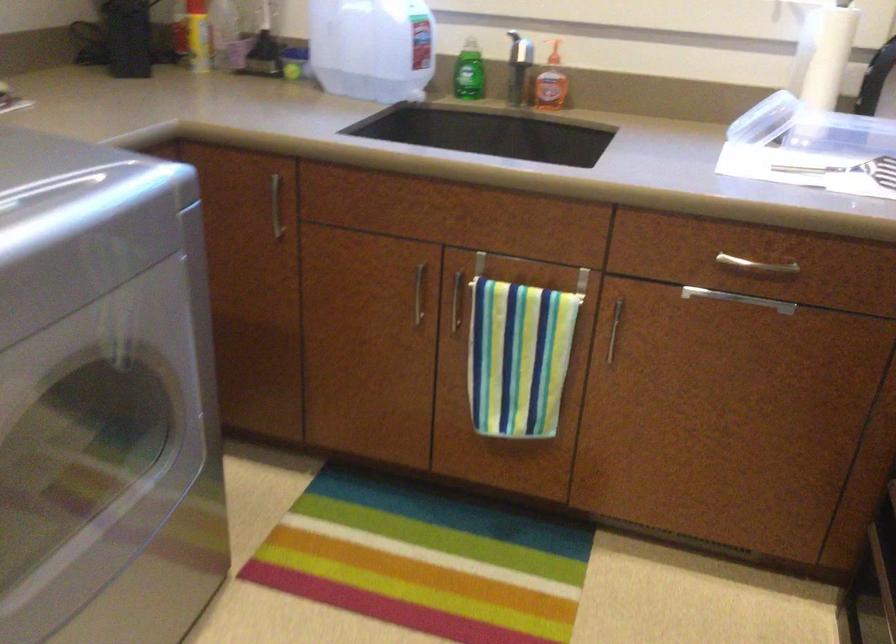
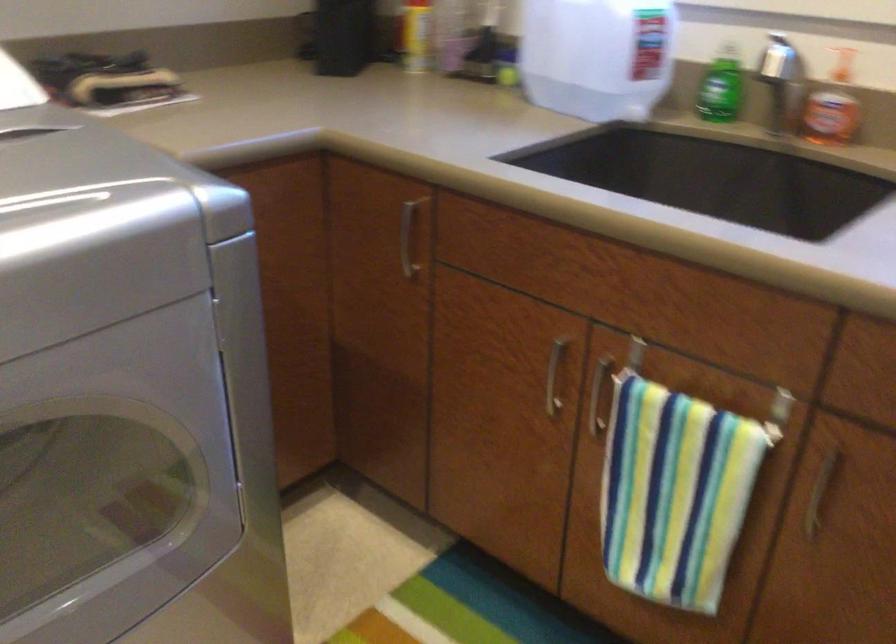
Where in the second image is the point corresponding to the point at 270,207 from the first image?

(407, 238)